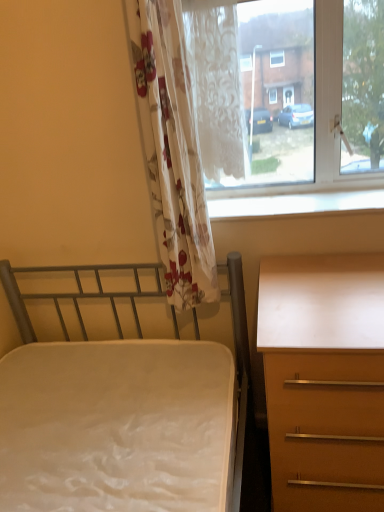
Where is `vacant region under white lace curtain at upper center, positioned as the 1th curtain in right-to-left order (from a real-world perspective)`? The height and width of the screenshot is (512, 384). vacant region under white lace curtain at upper center, positioned as the 1th curtain in right-to-left order (from a real-world perspective) is located at coordinates (226, 203).